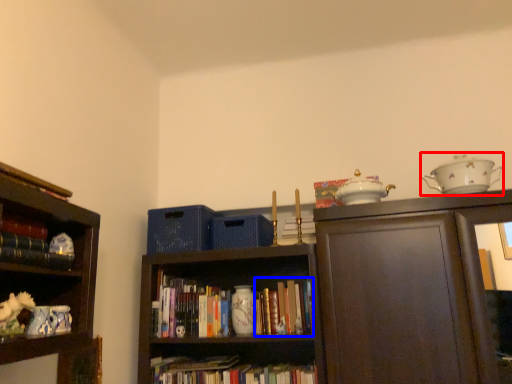
Question: Which object appears farthest to the camera in this image, tea set (highlighted by a red box) or book (highlighted by a blue box)?

Choices:
 (A) tea set
 (B) book

Answer: (B)